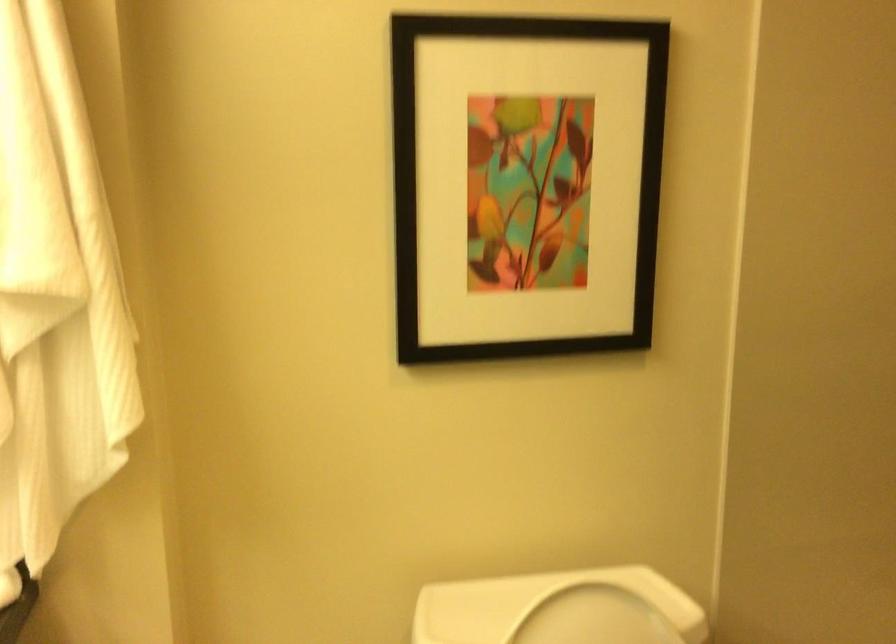
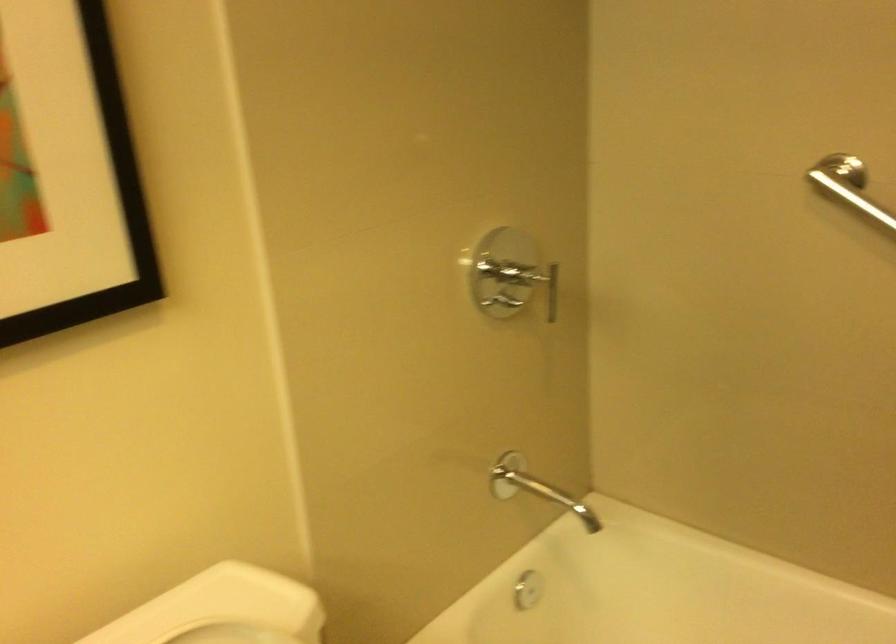
Question: The images are taken continuously from a first-person perspective. In which direction is your viewpoint rotating?

Choices:
 (A) Left
 (B) Right
 (C) Up
 (D) Down

Answer: (B)